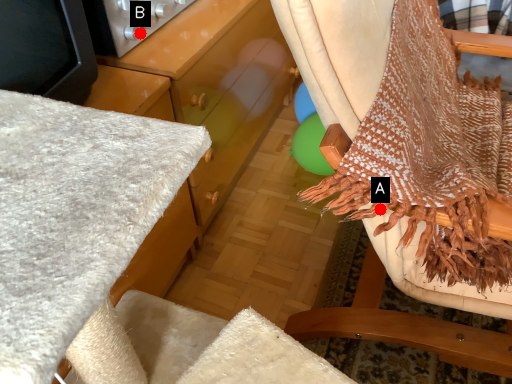
Question: Two points are circled on the image, labeled by A and B beside each circle. Which of the following is the closest to the observer?

Choices:
 (A) A is closer
 (B) B is closer

Answer: (A)